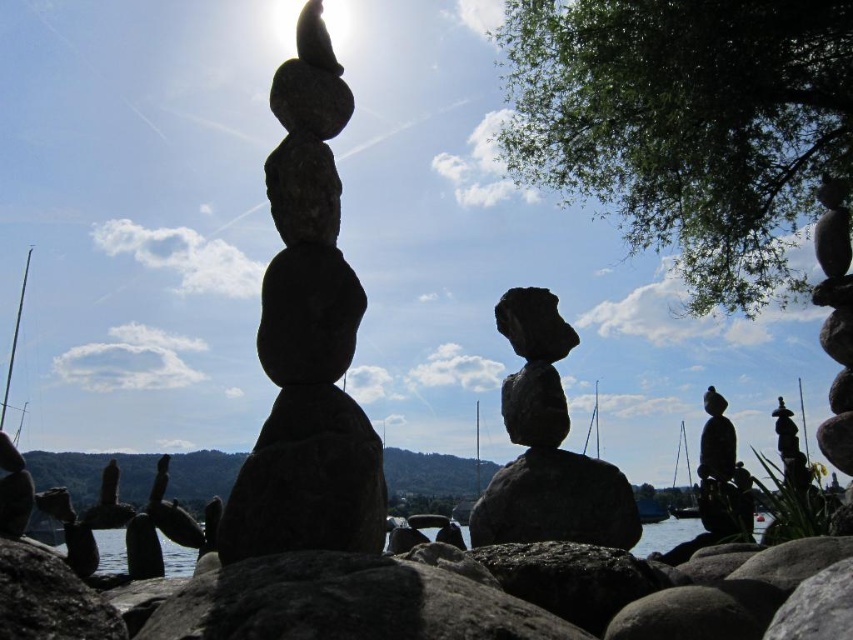
Is rough stone stack at center below transparent water at center?

Actually, rough stone stack at center is above transparent water at center.

Between point (585, 500) and point (434, 531), which one is positioned in front?

Point (585, 500) is in front.

Image resolution: width=853 pixels, height=640 pixels. What do you see at coordinates (547, 445) in the screenshot? I see `rough stone stack at center` at bounding box center [547, 445].

Find the location of `rough stone stack at center`. rough stone stack at center is located at coordinates (547, 445).

Which is behind, point (340, 285) or point (741, 536)?

Point (741, 536)

Measure the distance between smooth gray rock stack at center and camera.

A distance of 13.61 meters exists between smooth gray rock stack at center and camera.

Which is in front, point (312, 323) or point (721, 488)?

Point (312, 323)

The height and width of the screenshot is (640, 853). What are the coordinates of `smooth gray rock stack at center` in the screenshot? It's located at (306, 339).

Which is more to the left, rough stone stack at center or black stone statue at right?

rough stone stack at center

Which is below, rough stone stack at center or black stone statue at right?

black stone statue at right is below.

Which is behind, point (529, 419) or point (718, 456)?

Point (718, 456)

The height and width of the screenshot is (640, 853). I want to click on rough stone stack at center, so click(x=547, y=445).